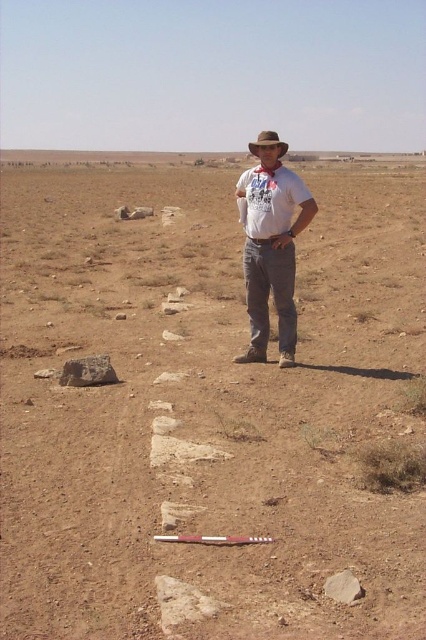
Can you confirm if matte white t-shirt at center is thinner than brown felt cowboy hat at center?

Yes, matte white t-shirt at center is thinner than brown felt cowboy hat at center.

How far apart are matte white t-shirt at center and brown felt cowboy hat at center?

They are 15.25 meters apart.

Describe the element at coordinates (271, 244) in the screenshot. The width and height of the screenshot is (426, 640). I see `matte white t-shirt at center` at that location.

In order to click on matte white t-shirt at center in this screenshot , I will do `click(271, 244)`.